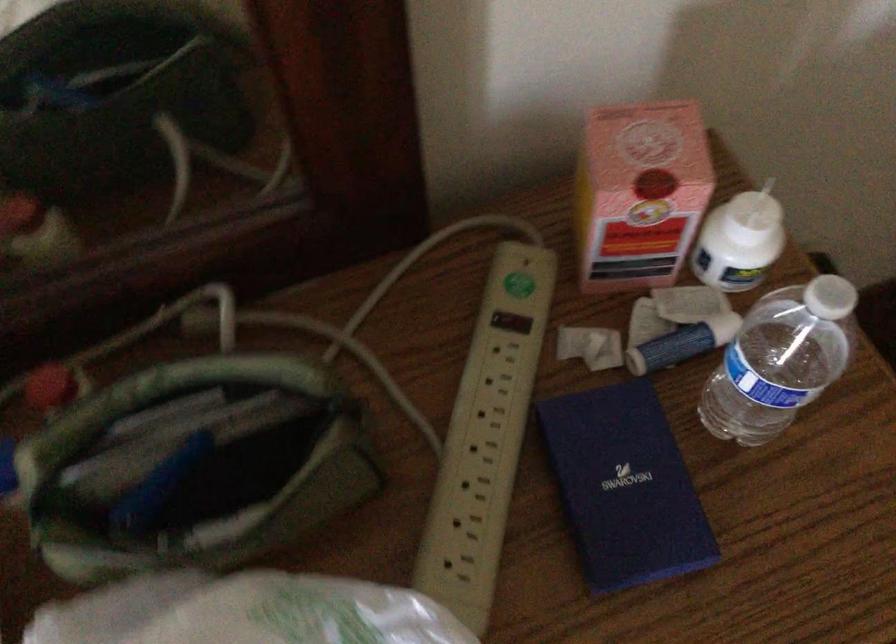
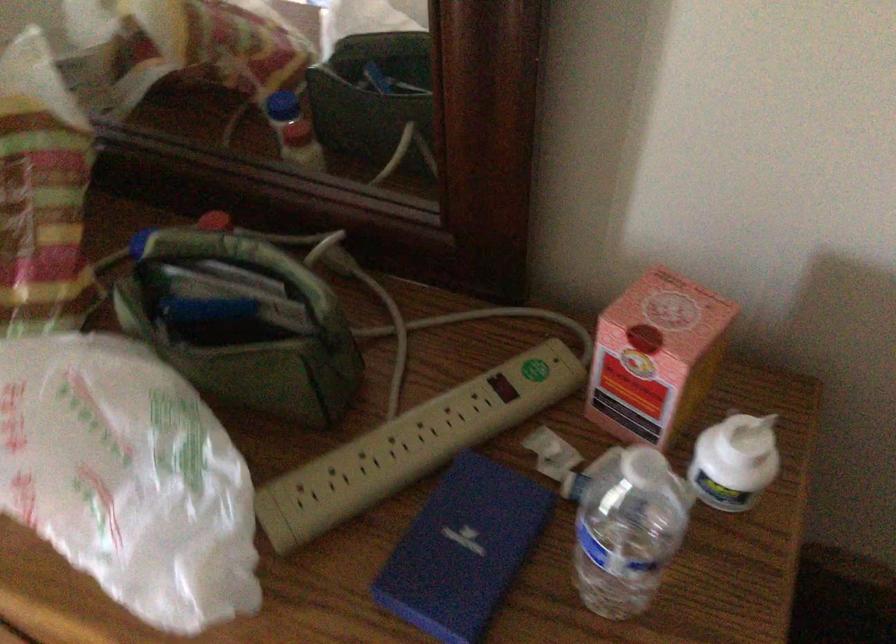
Where in the second image is the point corresponding to (767,245) from the first image?

(735, 462)